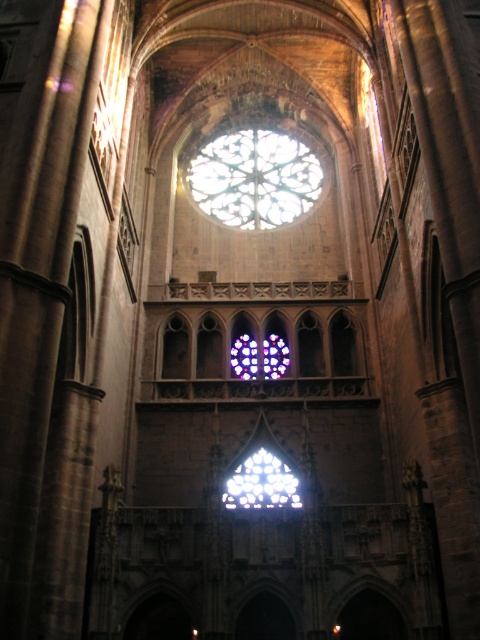
Looking at this image, you are standing inside the cathedral and notice two windows. One is the stained glass window at center and the other is the clear glass stained glass at center. Which window allows more light to pass through?

The clear glass stained glass at center allows more light to pass through because it is behind the stained glass window at center, meaning it is farther from the light source.

In the scene shown: You are an architect assessing the cathedral for restoration. You notice two types of windows in the cathedral. The first is the stained glass window at center, and the second is the clear glass stained glass at center. Which of these windows allows more natural light into the cathedral?

The clear glass stained glass at center allows more natural light into the cathedral because clear glass is more transparent than stained glass, which has colored patterns that block some light. However, according to the description, the stained glass window at center is taller than clear glass stained glass at center. Since the stained glass window is taller, it has a larger surface area, potentially allowing more light to pass through despite its coloring. Therefore, the stained glass window at center may